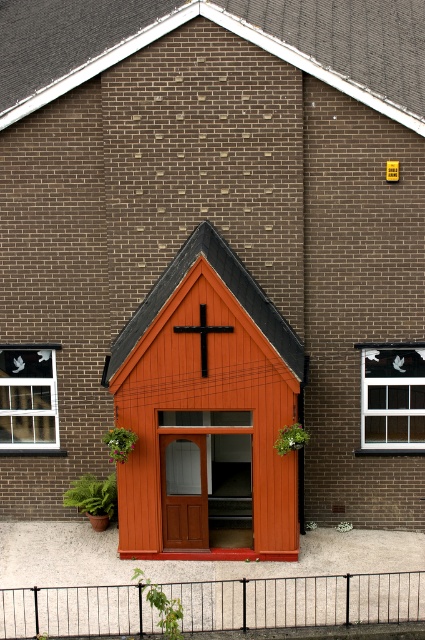
Question: Which object is positioned closest to the matte wood chapel at center?

Choices:
 (A) white textured window at upper right
 (B) black matte cross at center
 (C) clear glass window at left

Answer: (B)

Question: Can you confirm if white textured window at upper right is smaller than clear glass window at left?

Choices:
 (A) no
 (B) yes

Answer: (B)

Question: Estimate the real-world distances between objects in this image. Which object is closer to the black matte cross at center?

Choices:
 (A) matte wood chapel at center
 (B) clear glass window at left

Answer: (A)

Question: Can you confirm if matte wood chapel at center is smaller than white textured window at upper right?

Choices:
 (A) no
 (B) yes

Answer: (A)

Question: Where is clear glass window at left located in relation to black matte cross at center in the image?

Choices:
 (A) below
 (B) above

Answer: (A)

Question: Which of the following is the farthest from the observer?

Choices:
 (A) white textured window at upper right
 (B) matte wood chapel at center
 (C) black matte cross at center

Answer: (A)